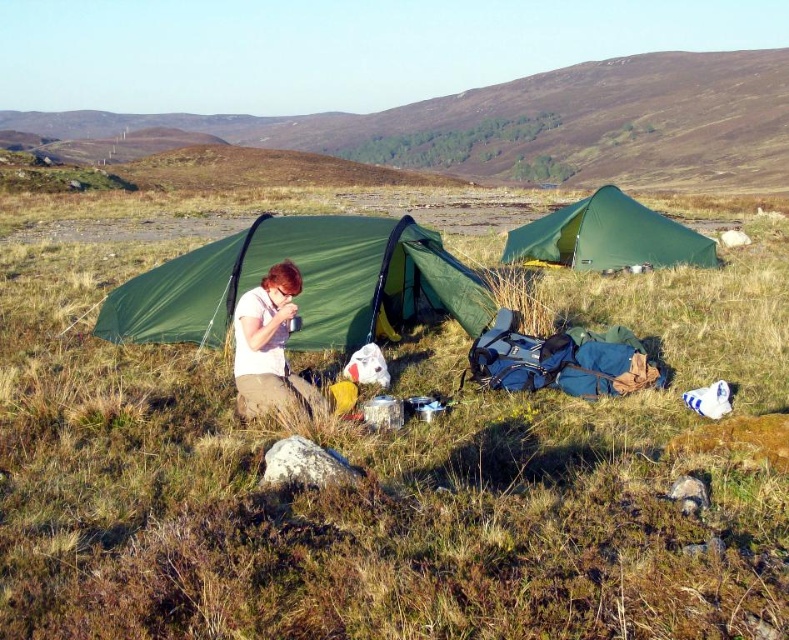
Is point (664, 259) positioned in front of point (253, 317)?

No, (664, 259) is further to viewer.

I want to click on green canvas tent at center, so click(608, 236).

Is green fabric tent at center closer to the viewer compared to matte white mug at center?

No.

Does green fabric tent at center appear under matte white mug at center?

No, green fabric tent at center is not below matte white mug at center.

The width and height of the screenshot is (789, 640). What are the coordinates of `green fabric tent at center` in the screenshot? It's located at (303, 284).

Does green fabric tent at center have a greater width compared to green canvas tent at center?

Correct, the width of green fabric tent at center exceeds that of green canvas tent at center.

Does green fabric tent at center have a lesser width compared to green canvas tent at center?

No.

Which is in front, point (305, 236) or point (515, 248)?

Point (305, 236) is in front.

I want to click on green fabric tent at center, so click(303, 284).